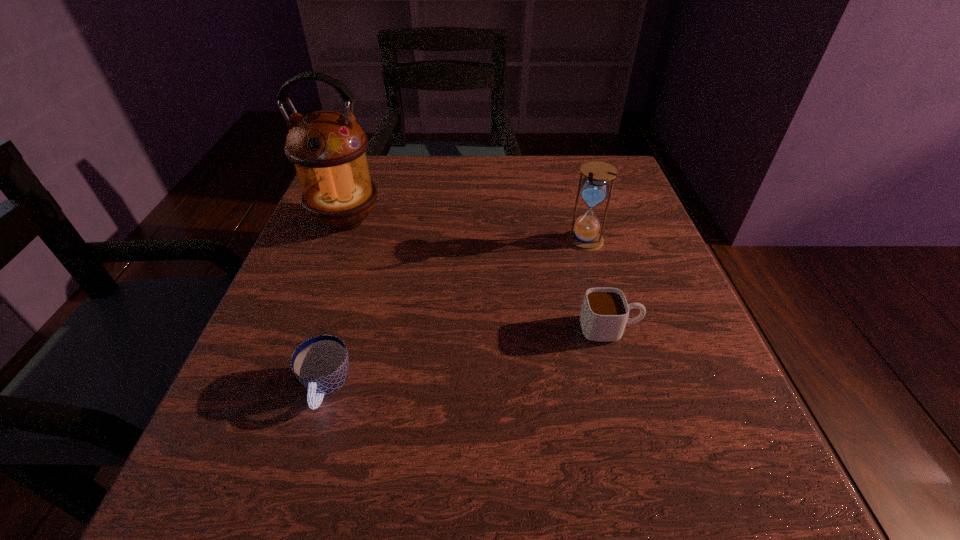
Where is `oil lamp`? This screenshot has height=540, width=960. oil lamp is located at coordinates (328, 148).

You are a GUI agent. You are given a task and a screenshot of the screen. Output one action in this format:
    pyautogui.click(x=<x>, y=<y>)
    Task: Click on the second tallest object
    
    Given the screenshot: What is the action you would take?
    pyautogui.click(x=585, y=236)

The width and height of the screenshot is (960, 540). In order to click on the second nearest object in this screenshot , I will do `click(604, 313)`.

This screenshot has width=960, height=540. I want to click on the right cup, so click(604, 313).

Identify the location of the nearest object. The width and height of the screenshot is (960, 540). (321, 363).

The height and width of the screenshot is (540, 960). Find the location of `the left cup`. the left cup is located at coordinates (321, 363).

This screenshot has width=960, height=540. Identify the location of free region located 0.060m on the back of the oil lamp. (358, 187).

Locate an element on the screen. The width and height of the screenshot is (960, 540). vacant space situated on the right of the hourglass is located at coordinates (628, 241).

Find the location of a particular element. free space located 0.070m on the side with the handle of the second nearest object is located at coordinates (682, 329).

Where is `vacant position located on the side of the left cup with the handle`? This screenshot has height=540, width=960. vacant position located on the side of the left cup with the handle is located at coordinates (300, 478).